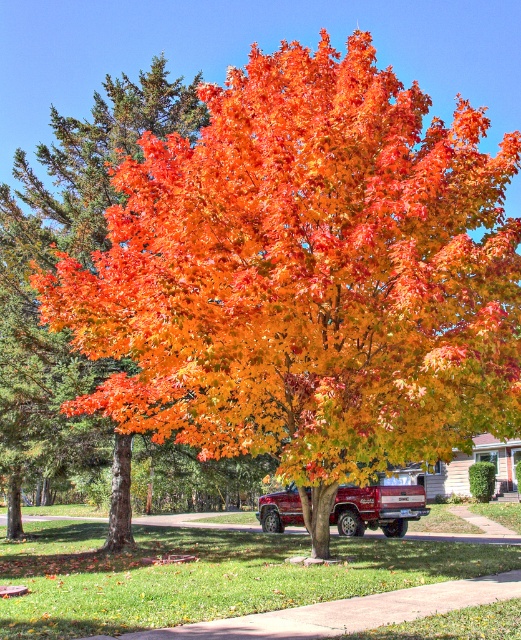
Does green grass at center have a lesser height compared to metallic red pickup truck at center?

Incorrect, green grass at center's height does not fall short of metallic red pickup truck at center's.

Between point (270, 586) and point (267, 516), which one is positioned in front?

Positioned in front is point (270, 586).

At what (x,y) coordinates should I click in order to perform the action: click on green grass at center. Please return your answer as a coordinate pair (x, y). The image size is (521, 640). Looking at the image, I should click on (205, 576).

I want to click on green grass at center, so click(x=205, y=576).

Does green grass at center appear on the right side of orange glossy tree at center?

Correct, you'll find green grass at center to the right of orange glossy tree at center.

Locate an element on the screen. The height and width of the screenshot is (640, 521). green grass at center is located at coordinates (205, 576).

Between orange glossy tree at center and metallic red pickup truck at center, which one has less height?

Standing shorter between the two is metallic red pickup truck at center.

Is point (45, 259) positioned behind point (415, 499)?

No, (45, 259) is closer to viewer.

The width and height of the screenshot is (521, 640). Identify the location of orange glossy tree at center. (75, 236).